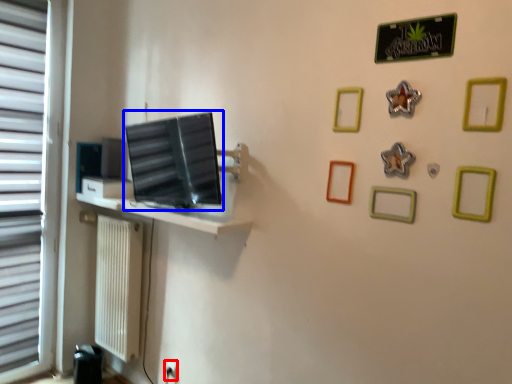
Question: Which of the following is the farthest to the observer, electric outlet (highlighted by a red box) or computer monitor (highlighted by a blue box)?

Choices:
 (A) electric outlet
 (B) computer monitor

Answer: (A)